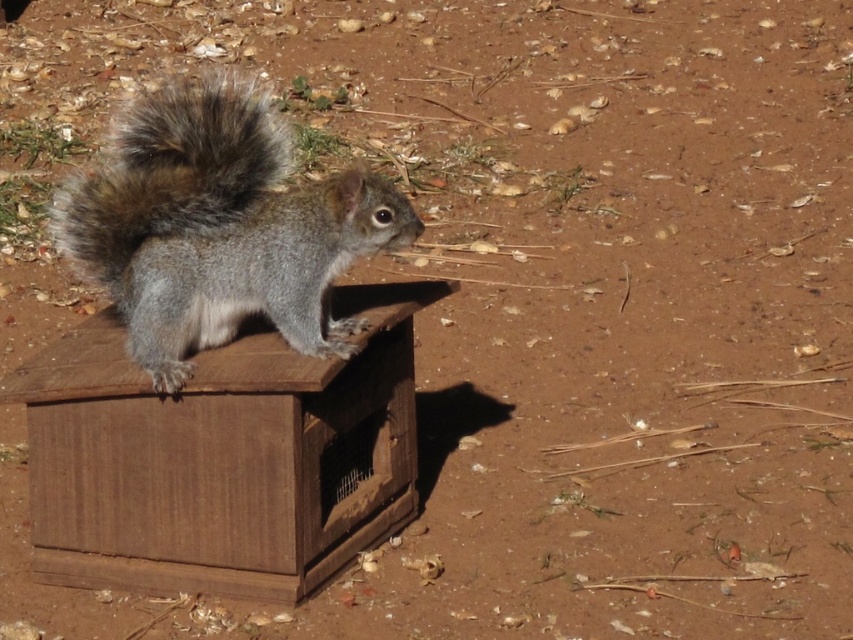
You are standing 2.79 meters away from the wooden crate at center. If you want to place a small snack for the squirrel, would you be able to do so without moving closer than your current position?

The wooden crate at center and the viewer are 2.79 meters apart. Since you are already at that distance, you can place the snack without needing to move closer.

You are standing 3 meters away from a wooden structure with a squirrel on top. There is a specific point at coordinates point (267, 436). Can you reach that point with a 3.5 meter long pole without moving closer to the structure?

The distance of point (267, 436) from the camera is 2.98 meters. Since the pole is 3.5 meters long, which is longer than the distance to the point, you can reach it without moving closer.

Looking at this image, you are observing a squirrel on a wooden structure. You notice the gray furry squirrel on the left and the fuzzy fur tail at upper center. Which of these two objects is positioned more to the right?

The gray furry squirrel on the left is positioned more to the right than the fuzzy fur tail at upper center.